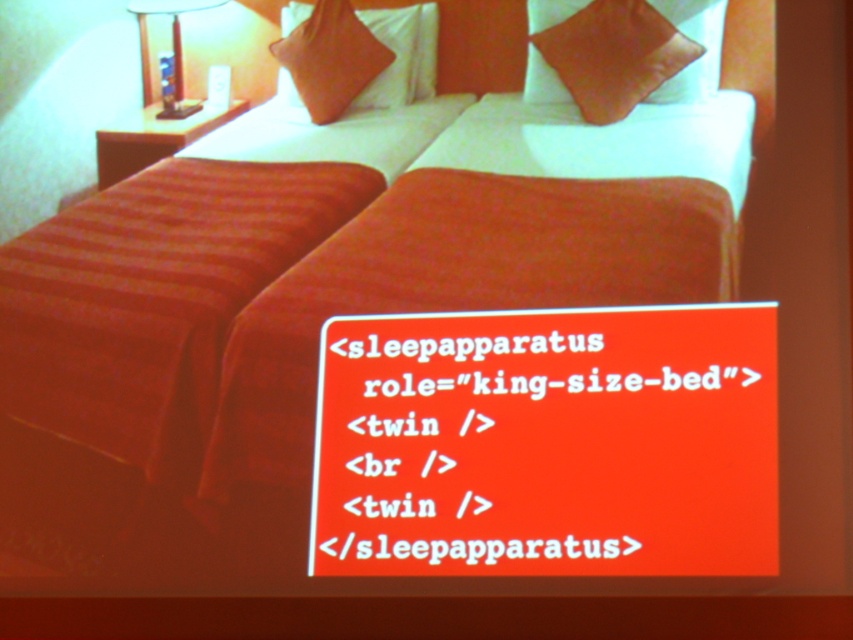
Question: Does white text on red background at center appear over satin orange pillow at upper right?

Choices:
 (A) yes
 (B) no

Answer: (B)

Question: Among these objects, which one is nearest to the camera?

Choices:
 (A) white text on red background at center
 (B) orange fabric pillow at upper center

Answer: (A)

Question: Can you confirm if satin orange pillow at upper right is smaller than orange fabric pillow at upper center?

Choices:
 (A) yes
 (B) no

Answer: (A)

Question: Based on their relative distances, which object is farther from the satin orange pillow at upper right?

Choices:
 (A) matte white lamp at upper left
 (B) orange fabric pillow at upper center
 (C) white text on red background at center

Answer: (C)

Question: Which object is the farthest from the satin orange pillow at upper right?

Choices:
 (A) white text on red background at center
 (B) orange fabric pillow at upper center
 (C) matte white lamp at upper left

Answer: (A)

Question: Can you confirm if white text on red background at center is wider than matte white lamp at upper left?

Choices:
 (A) yes
 (B) no

Answer: (B)